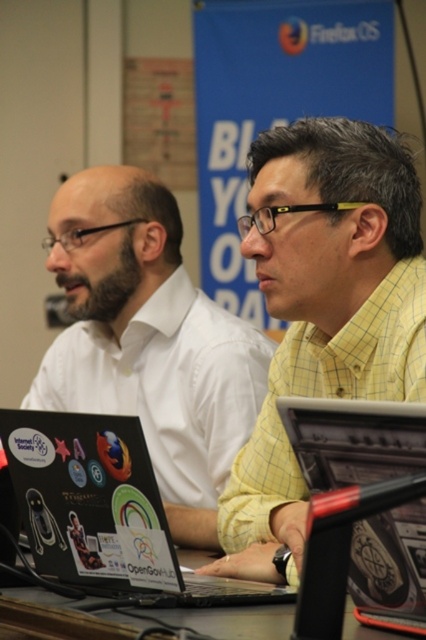
Does yellow checkered shirt at center have a lesser height compared to sticker-covered plastic laptop at center?

No, yellow checkered shirt at center is not shorter than sticker-covered plastic laptop at center.

The width and height of the screenshot is (426, 640). What do you see at coordinates (322, 310) in the screenshot?
I see `yellow checkered shirt at center` at bounding box center [322, 310].

This screenshot has width=426, height=640. Find the location of `yellow checkered shirt at center`. yellow checkered shirt at center is located at coordinates (322, 310).

Is point (348, 353) in front of point (423, 419)?

No, (348, 353) is behind (423, 419).

Who is more distant from viewer, [247,566] or [304,586]?

Point [247,566]

Where is `yellow checkered shirt at center`? yellow checkered shirt at center is located at coordinates (322, 310).

Is white glossy shirt at left wider than black plastic table at lower center?

Correct, the width of white glossy shirt at left exceeds that of black plastic table at lower center.

Between white glossy shirt at left and black plastic table at lower center, which one is positioned lower?

black plastic table at lower center is below.

In order to click on white glossy shirt at left in this screenshot , I will do [149, 340].